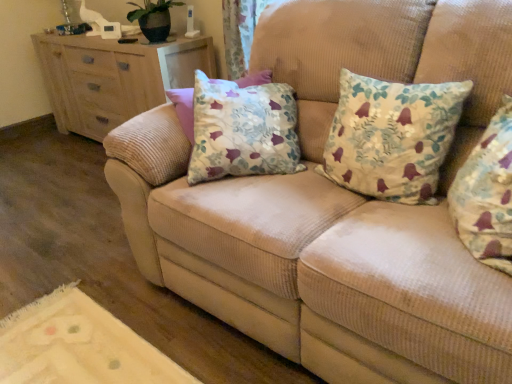
What do you see at coordinates (392, 137) in the screenshot? This screenshot has height=384, width=512. I see `floral fabric pillow at center, the second pillow positioned from the front` at bounding box center [392, 137].

Locate an element on the screen. The image size is (512, 384). wooden chest of drawers at left is located at coordinates (114, 78).

At what (x,y) coordinates should I click in order to perform the action: click on floral fabric pillow at center, the second pillow positioned from the front. Please return your answer as a coordinate pair (x, y). The width and height of the screenshot is (512, 384). Looking at the image, I should click on (392, 137).

Is there a large distance between floral fabric pillow at center, arranged as the first pillow when viewed from the back, and wooden chest of drawers at left?

→ Yes, floral fabric pillow at center, arranged as the first pillow when viewed from the back, and wooden chest of drawers at left are located far from each other.

From the picture: Is floral fabric pillow at center, arranged as the first pillow when viewed from the back, thinner than wooden chest of drawers at left?

Yes, floral fabric pillow at center, arranged as the first pillow when viewed from the back, is thinner than wooden chest of drawers at left.

From the picture: How much distance is there between floral fabric pillow at center, the second pillow positioned from the front, and wooden chest of drawers at left?

1.65 meters.

Considering the positions of point (366, 83) and point (96, 83), is point (366, 83) closer or farther from the camera than point (96, 83)?

Point (366, 83) is closer to the camera than point (96, 83).

Considering the relative positions of floral fabric pillow at center, arranged as the first pillow when viewed from the back, and floral fabric cushion at center, which is the 1th pillow from front to back, in the image provided, is floral fabric pillow at center, arranged as the first pillow when viewed from the back, behind floral fabric cushion at center, which is the 1th pillow from front to back,?

Yes, floral fabric pillow at center, arranged as the first pillow when viewed from the back, is further from the viewer.

Considering the relative sizes of floral fabric pillow at center, the second pillow positioned from the front, and floral fabric cushion at center, which is the 1th pillow from front to back, in the image provided, is floral fabric pillow at center, the second pillow positioned from the front, smaller than floral fabric cushion at center, which is the 1th pillow from front to back,?

No, floral fabric pillow at center, the second pillow positioned from the front, is not smaller than floral fabric cushion at center, which is the 1th pillow from front to back.

Considering the positions of objects floral fabric pillow at center, the second pillow positioned from the front, and floral fabric cushion at center, placed as the second pillow when sorted from back to front, in the image provided, who is more to the right, floral fabric pillow at center, the second pillow positioned from the front, or floral fabric cushion at center, placed as the second pillow when sorted from back to front,?

floral fabric cushion at center, placed as the second pillow when sorted from back to front.

Which is less distant, (x=114, y=106) or (x=409, y=176)?

Point (x=114, y=106) is positioned farther from the camera compared to point (x=409, y=176).

Which pillow is the 1st one when counting from the front of the wooden chest of drawers at left? Please provide its 2D coordinates.

[(392, 137)]

Considering the relative positions of wooden chest of drawers at left and floral fabric pillow at center, arranged as the first pillow when viewed from the back, in the image provided, is wooden chest of drawers at left to the left or to the right of floral fabric pillow at center, arranged as the first pillow when viewed from the back,?

wooden chest of drawers at left is positioned on floral fabric pillow at center, arranged as the first pillow when viewed from the back,'s left side.

The image size is (512, 384). I want to click on chest of drawers on the left of the floral fabric cushion at center, placed as the second pillow when sorted from back to front, so click(x=114, y=78).

Is wooden chest of drawers at left next to floral fabric cushion at center, placed as the second pillow when sorted from back to front, and touching it?

No, wooden chest of drawers at left is not in contact with floral fabric cushion at center, placed as the second pillow when sorted from back to front.

Is wooden chest of drawers at left turned away from floral fabric cushion at center, which is the 1th pillow from front to back?

That's not correct — wooden chest of drawers at left is not looking away from floral fabric cushion at center, which is the 1th pillow from front to back.

From a real-world perspective, is floral fabric cushion at center, placed as the second pillow when sorted from back to front, positioned above or below wooden chest of drawers at left?

Clearly, from a real-world perspective, floral fabric cushion at center, placed as the second pillow when sorted from back to front, is above wooden chest of drawers at left.

From the image's perspective, which object appears higher, floral fabric cushion at center, placed as the second pillow when sorted from back to front, or wooden chest of drawers at left?

From the image's view, wooden chest of drawers at left is above.

Does floral fabric cushion at center, placed as the second pillow when sorted from back to front, turn towards wooden chest of drawers at left?

No, floral fabric cushion at center, placed as the second pillow when sorted from back to front, is not aimed at wooden chest of drawers at left.

Based on the photo, could wooden chest of drawers at left be considered to be inside floral fabric cushion at center, placed as the second pillow when sorted from back to front?

No, wooden chest of drawers at left is not surrounded by floral fabric cushion at center, placed as the second pillow when sorted from back to front.

Is floral fabric cushion at center, which is the 1th pillow from front to back, closer to camera compared to floral fabric pillow at center, the second pillow positioned from the front?

Yes.

From the image's perspective, does floral fabric cushion at center, which is the 1th pillow from front to back, appear lower than floral fabric pillow at center, the second pillow positioned from the front?

Yes, from the image's perspective, floral fabric cushion at center, which is the 1th pillow from front to back, is below floral fabric pillow at center, the second pillow positioned from the front.

Which object is thinner, floral fabric cushion at center, which is the 1th pillow from front to back, or floral fabric pillow at center, arranged as the first pillow when viewed from the back?

With smaller width is floral fabric cushion at center, which is the 1th pillow from front to back.

Who is taller, floral fabric cushion at center, placed as the second pillow when sorted from back to front, or floral fabric pillow at center, the second pillow positioned from the front?

floral fabric cushion at center, placed as the second pillow when sorted from back to front.

Where is `pillow that is the 1st object located in front of the wooden chest of drawers at left`? This screenshot has width=512, height=384. pillow that is the 1st object located in front of the wooden chest of drawers at left is located at coordinates (392, 137).

This screenshot has height=384, width=512. Find the location of `pillow above the floral fabric pillow at center, arranged as the first pillow when viewed from the back (from a real-world perspective)`. pillow above the floral fabric pillow at center, arranged as the first pillow when viewed from the back (from a real-world perspective) is located at coordinates (487, 194).

Looking at the image, which one is located further to wooden chest of drawers at left, floral fabric cushion at center, placed as the second pillow when sorted from back to front, or floral fabric pillow at center, arranged as the first pillow when viewed from the back?

floral fabric cushion at center, placed as the second pillow when sorted from back to front, lies further to wooden chest of drawers at left than the other object.

Estimate the real-world distances between objects in this image. Which object is further from floral fabric cushion at center, placed as the second pillow when sorted from back to front, floral fabric pillow at center, the second pillow positioned from the front, or wooden chest of drawers at left?

wooden chest of drawers at left is further to floral fabric cushion at center, placed as the second pillow when sorted from back to front.

From the image, which object appears to be farther from floral fabric cushion at center, which is the 1th pillow from front to back, wooden chest of drawers at left or floral fabric pillow at center, the second pillow positioned from the front?

wooden chest of drawers at left is further to floral fabric cushion at center, which is the 1th pillow from front to back.

Which object lies nearer to the anchor point wooden chest of drawers at left, floral fabric pillow at center, arranged as the first pillow when viewed from the back, or floral fabric cushion at center, which is the 1th pillow from front to back?

floral fabric pillow at center, arranged as the first pillow when viewed from the back, is positioned closer to the anchor wooden chest of drawers at left.

Estimate the real-world distances between objects in this image. Which object is closer to floral fabric pillow at center, the second pillow positioned from the front, floral fabric cushion at center, which is the 1th pillow from front to back, or wooden chest of drawers at left?

floral fabric cushion at center, which is the 1th pillow from front to back.

Estimate the real-world distances between objects in this image. Which object is further from floral fabric pillow at center, the second pillow positioned from the front, wooden chest of drawers at left or floral fabric cushion at center, which is the 1th pillow from front to back?

wooden chest of drawers at left is positioned further to the anchor floral fabric pillow at center, the second pillow positioned from the front.

Image resolution: width=512 pixels, height=384 pixels. What are the coordinates of `pillow between wooden chest of drawers at left and floral fabric cushion at center, placed as the second pillow when sorted from back to front, from left to right` in the screenshot? It's located at (392, 137).